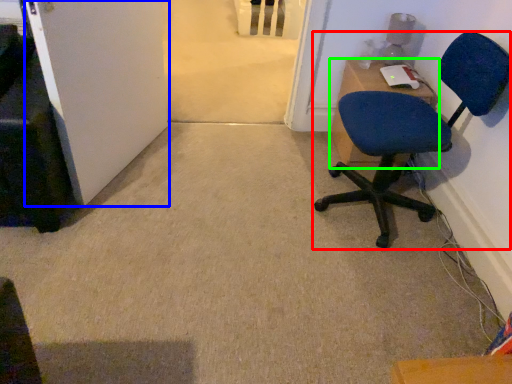
Question: Which object is the closest to the chair (highlighted by a red box)? Choose among these: door (highlighted by a blue box) or desk (highlighted by a green box).

Choices:
 (A) door
 (B) desk

Answer: (B)